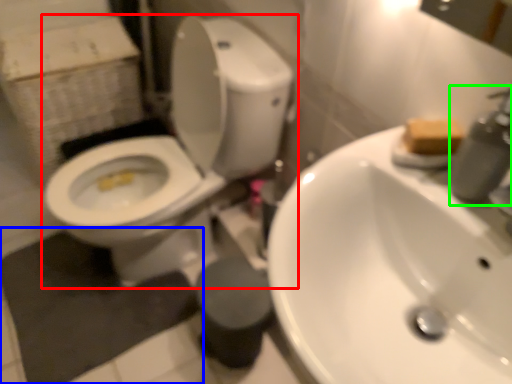
Question: Which object is positioned closest to toilet (highlighted by a red box)? Select from bath mat (highlighted by a blue box) and plumbing fixture (highlighted by a green box).

Choices:
 (A) bath mat
 (B) plumbing fixture

Answer: (A)